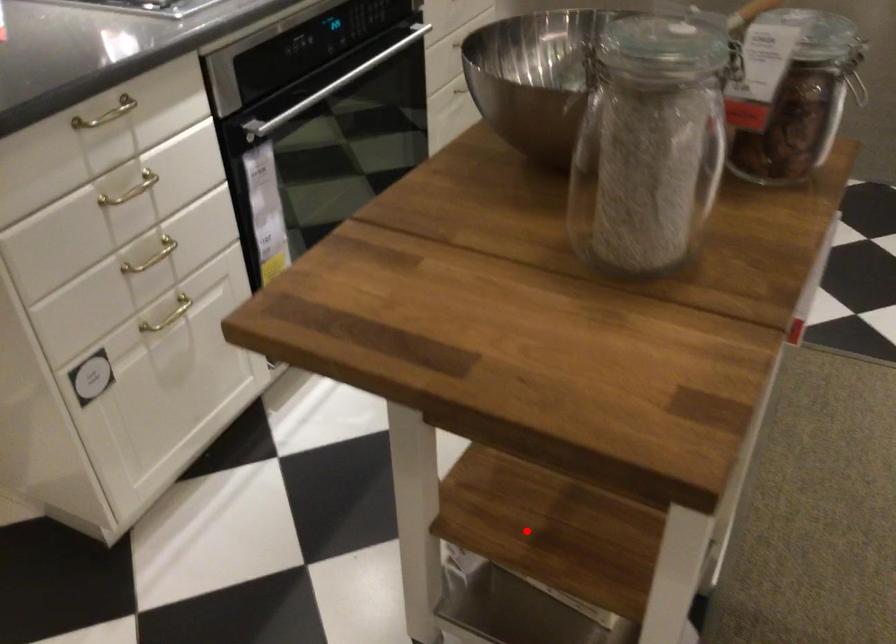
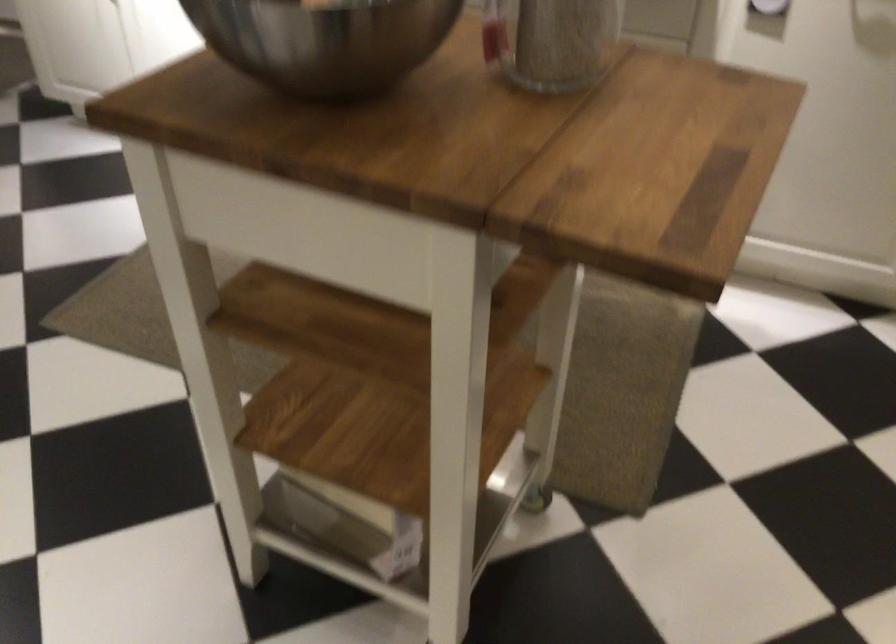
Locate, in the second image, the point that corresponds to the highlighted location in the first image.

(352, 524)